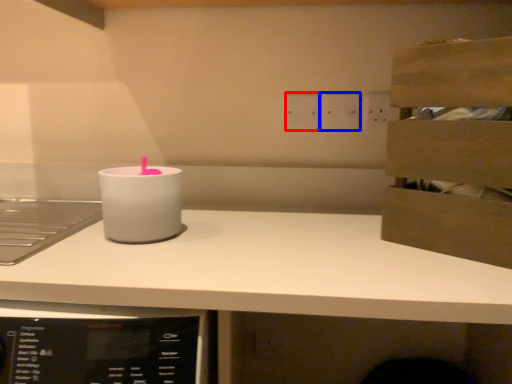
Question: Which object appears closest to the camera in this image, electric outlet (highlighted by a red box) or electric outlet (highlighted by a blue box)?

Choices:
 (A) electric outlet
 (B) electric outlet

Answer: (B)